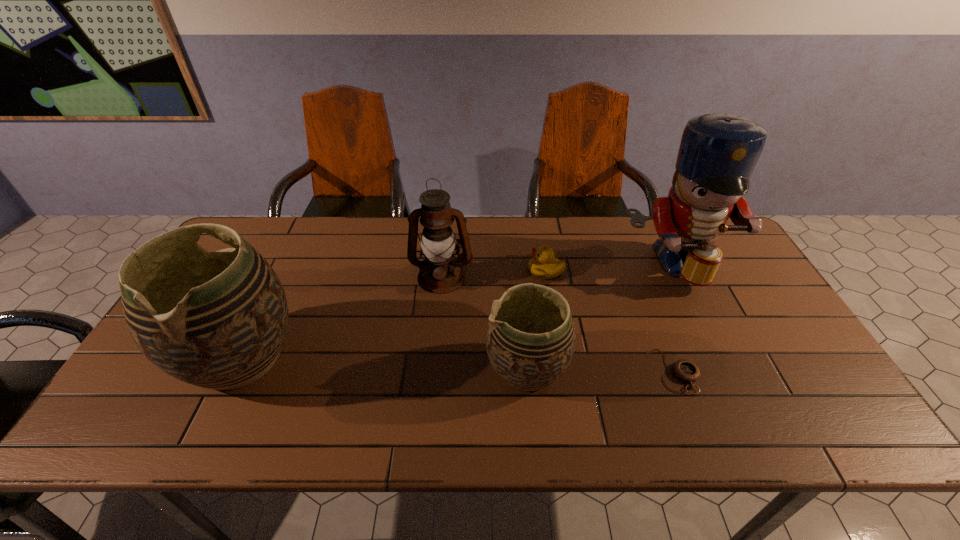
In order to click on vacant space situated 0.320m on the front-facing side of the tallest object in this screenshot , I will do pyautogui.click(x=733, y=393).

Find the location of a particular element. The height and width of the screenshot is (540, 960). vacant space located on the front-facing side of the duckling is located at coordinates (482, 271).

This screenshot has width=960, height=540. I want to click on vacant region located 0.050m on the front-facing side of the duckling, so click(x=512, y=271).

This screenshot has width=960, height=540. What are the coordinates of `free location located 0.340m on the front-facing side of the duckling` in the screenshot? It's located at pyautogui.click(x=417, y=271).

What are the coordinates of `vacant space located on the side of the lantern, there is a wick adjustment knob` in the screenshot? It's located at (436, 343).

Where is `free point located on the back of the shortest object`? This screenshot has height=540, width=960. free point located on the back of the shortest object is located at coordinates (635, 268).

Where is `nutcracker located in the far edge section of the desktop`? This screenshot has width=960, height=540. nutcracker located in the far edge section of the desktop is located at coordinates (718, 152).

The width and height of the screenshot is (960, 540). Find the location of `duckling that is at the far edge`. duckling that is at the far edge is located at coordinates (543, 265).

Image resolution: width=960 pixels, height=540 pixels. What are the coordinates of `lantern present at the far edge` in the screenshot? It's located at (437, 241).

Where is `pocket watch positioned at the near edge`? The height and width of the screenshot is (540, 960). pocket watch positioned at the near edge is located at coordinates (685, 370).